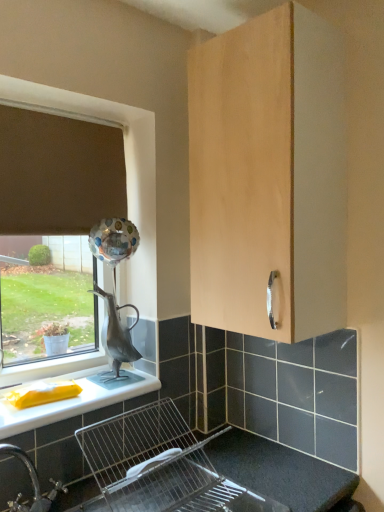
Question: Considering the positions of light wood cabinet at upper center and metallic silver sink at lower center in the image, is light wood cabinet at upper center wider or thinner than metallic silver sink at lower center?

Choices:
 (A) thin
 (B) wide

Answer: (A)

Question: Is light wood cabinet at upper center bigger or smaller than metallic silver sink at lower center?

Choices:
 (A) small
 (B) big

Answer: (B)

Question: Based on their relative distances, which object is nearer to the light wood cabinet at upper center?

Choices:
 (A) white glossy countertop at lower left
 (B) brown fabric curtain at upper left
 (C) metallic silver sink at lower center

Answer: (B)

Question: Based on their relative distances, which object is nearer to the light wood cabinet at upper center?

Choices:
 (A) brown fabric curtain at upper left
 (B) metallic silver sink at lower center
 (C) white glossy countertop at lower left

Answer: (A)